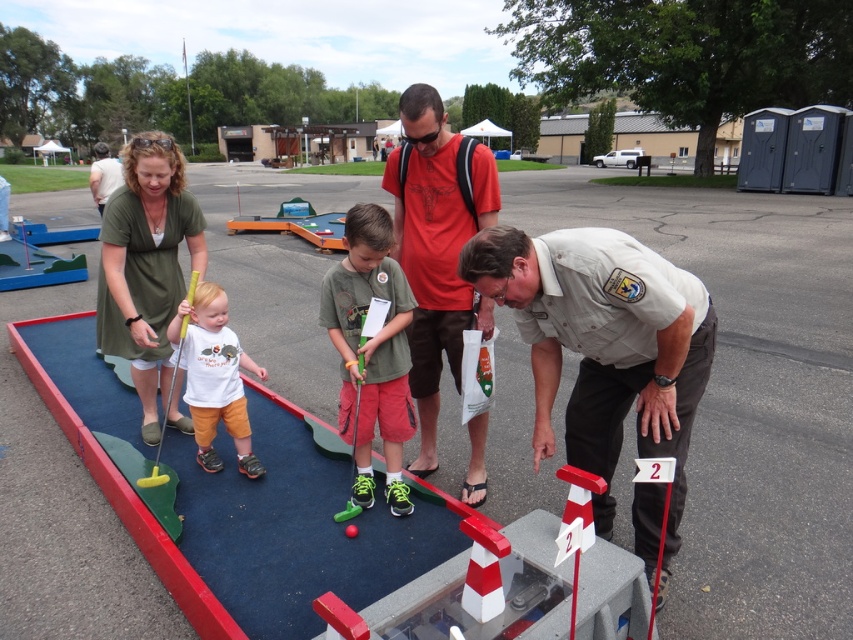
Question: Which point is closer to the camera?

Choices:
 (A) red cotton t-shirt at center
 (B) matte green dress at upper left

Answer: (B)

Question: Which of the following is the closest to the observer?

Choices:
 (A) green matte golf club at center
 (B) red cotton t-shirt at center
 (C) white cotton shirt at center

Answer: (B)

Question: Which object is positioned closest to the khaki uniform at center?

Choices:
 (A) matte green dress at upper left
 (B) green matte golf club at center
 (C) white cotton shirt at center
 (D) smooth plastic barrier at center

Answer: (A)

Question: Can you confirm if smooth plastic barrier at center is smaller than red cotton t-shirt at center?

Choices:
 (A) yes
 (B) no

Answer: (B)

Question: Does matte green dress at upper left appear under green matte golf club at center?

Choices:
 (A) no
 (B) yes

Answer: (B)

Question: Can you confirm if red cotton t-shirt at center is wider than white cotton shirt at center?

Choices:
 (A) no
 (B) yes

Answer: (A)